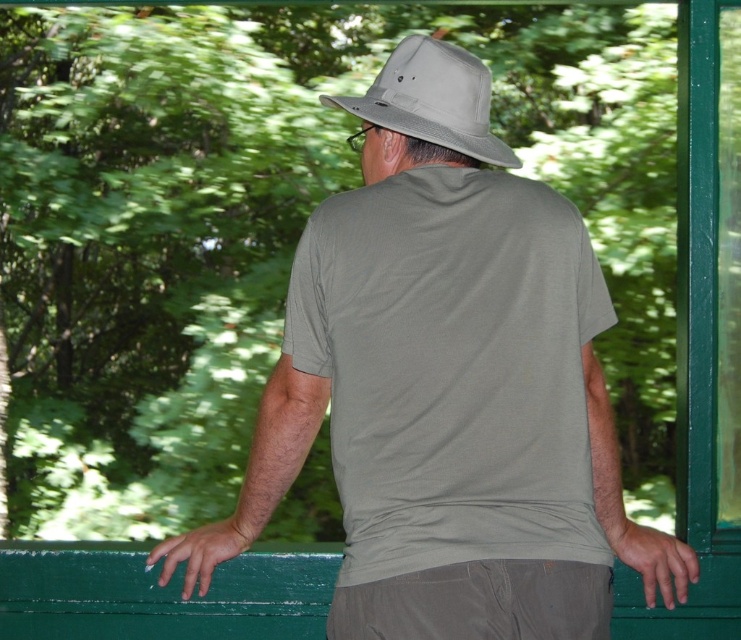
You are a photographer trying to capture the person in the scene. You want to ensure both the matte khaki hat at center and the gray fabric fedora at upper center are clearly visible in your shot. Which hat should you focus on first to ensure it doesn t get cut out of the frame?

The matte khaki hat at center is located below the gray fabric fedora at upper center, so you should focus on the gray fabric fedora at upper center first to ensure it stays within the frame.

You are a photographer trying to capture the person in the scene. You notice two points in the image labeled as point 1 at coordinates [378,218] and point 2 at [358,100]. Which point is closer to the camera lens when taking the photo?

Point 1 at coordinates [378,218] is closer to the camera lens than point 2 at [358,100].

You are a photographer wanting to capture the person in the scene. Since you have a camera with a zoom lens, you want to focus on the matte khaki hat at center and the gray fabric fedora at upper center. Which object should you zoom in on first if you want to capture more details of the smaller one?

You should zoom in on the gray fabric fedora at upper center first because it is smaller than the matte khaki hat at center, so zooming in on the smaller one will help capture more details.